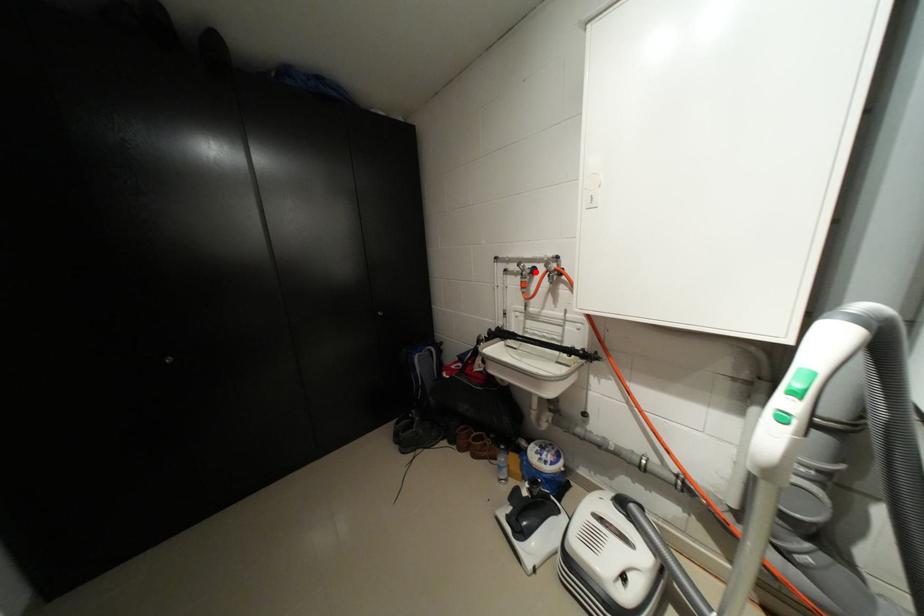
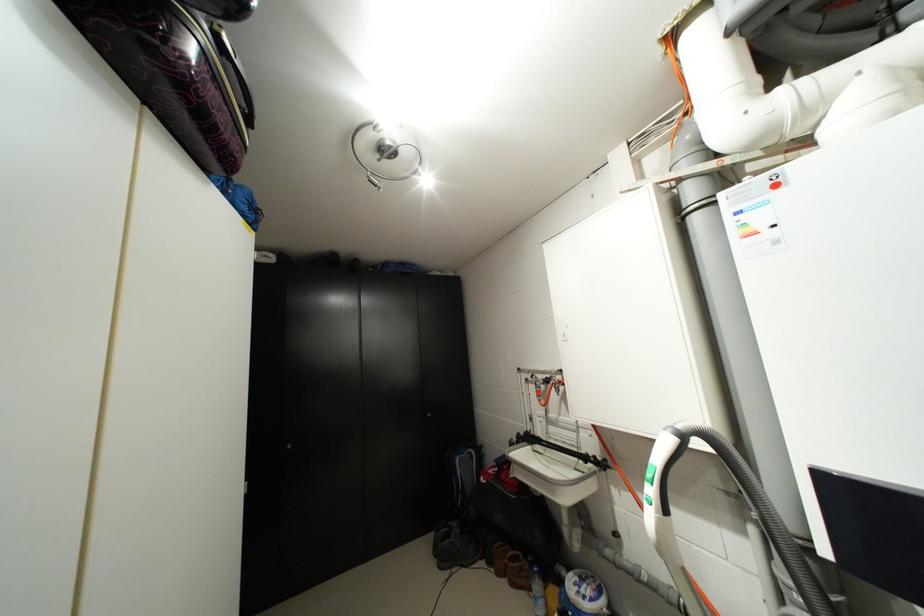
Locate, in the second image, the point that corresponds to the highlighted location in the first image.

(549, 383)